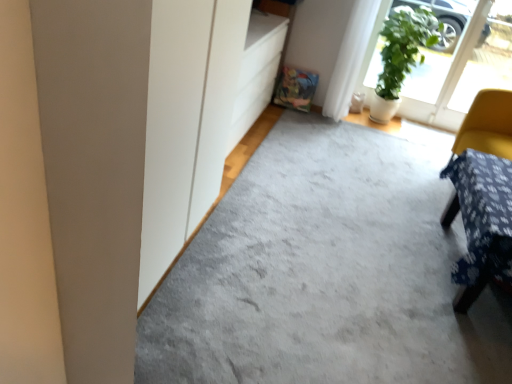
Question: From the image's perspective, is green leafy plant at upper right beneath blue fabric-covered table at right?

Choices:
 (A) yes
 (B) no

Answer: (B)

Question: Does green leafy plant at upper right have a smaller size compared to blue fabric-covered table at right?

Choices:
 (A) yes
 (B) no

Answer: (B)

Question: Is the depth of green leafy plant at upper right greater than that of blue fabric-covered table at right?

Choices:
 (A) yes
 (B) no

Answer: (A)

Question: Could you tell me if green leafy plant at upper right is facing blue fabric-covered table at right?

Choices:
 (A) no
 (B) yes

Answer: (B)

Question: Is blue fabric-covered table at right inside green leafy plant at upper right?

Choices:
 (A) yes
 (B) no

Answer: (B)

Question: Can you confirm if green leafy plant at upper right is wider than blue fabric-covered table at right?

Choices:
 (A) yes
 (B) no

Answer: (B)

Question: Is green matte screen door at upper right to the right of yellow fabric-covered chair at right from the viewer's perspective?

Choices:
 (A) no
 (B) yes

Answer: (A)

Question: Is green matte screen door at upper right facing away from yellow fabric-covered chair at right?

Choices:
 (A) no
 (B) yes

Answer: (A)

Question: Is green matte screen door at upper right wider than yellow fabric-covered chair at right?

Choices:
 (A) yes
 (B) no

Answer: (B)

Question: Can you confirm if green matte screen door at upper right is bigger than yellow fabric-covered chair at right?

Choices:
 (A) no
 (B) yes

Answer: (A)

Question: From the image's perspective, is green matte screen door at upper right located above yellow fabric-covered chair at right?

Choices:
 (A) yes
 (B) no

Answer: (A)

Question: Is the position of green matte screen door at upper right more distant than that of yellow fabric-covered chair at right?

Choices:
 (A) yes
 (B) no

Answer: (A)

Question: From a real-world perspective, is green leafy plant at upper right physically below green matte screen door at upper right?

Choices:
 (A) no
 (B) yes

Answer: (B)